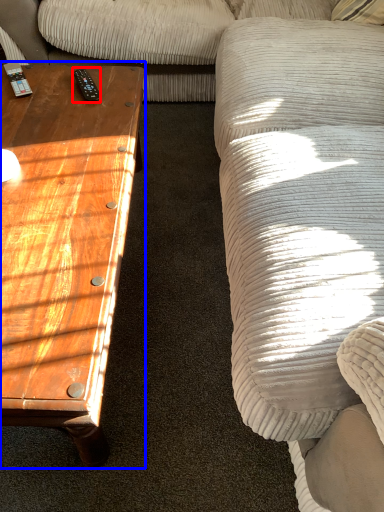
Question: Which object is further to the camera taking this photo, remote (highlighted by a red box) or coffee table (highlighted by a blue box)?

Choices:
 (A) remote
 (B) coffee table

Answer: (A)